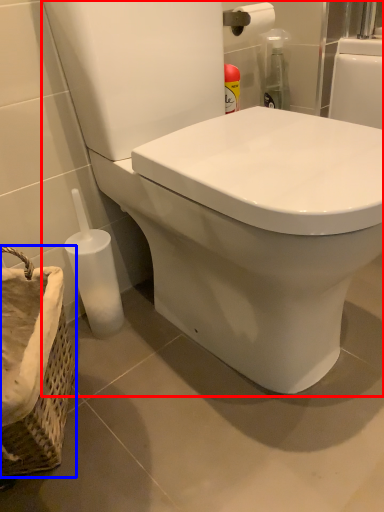
Question: Which object appears closest to the camera in this image, toilet (highlighted by a red box) or basket container (highlighted by a blue box)?

Choices:
 (A) toilet
 (B) basket container

Answer: (A)